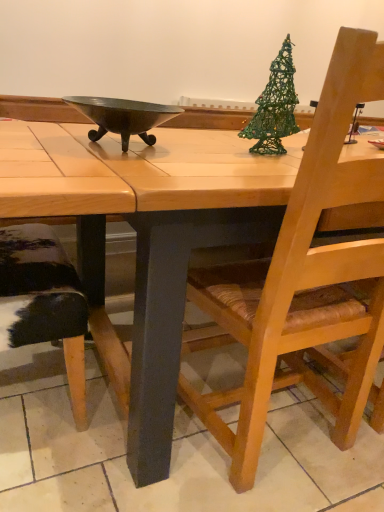
Find the location of a particular element. The width and height of the screenshot is (384, 512). vacant area that is in front of metallic dark gray bowl at center is located at coordinates (105, 165).